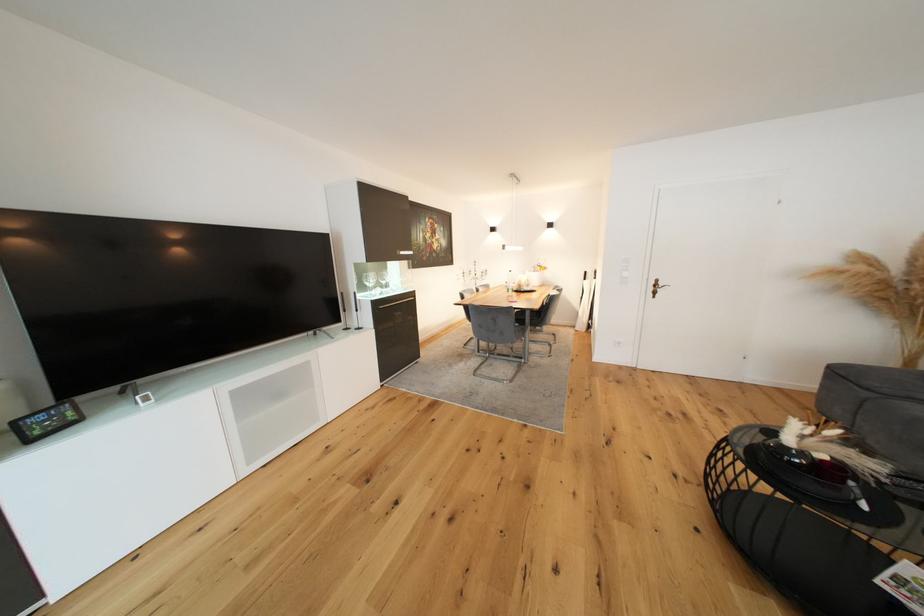
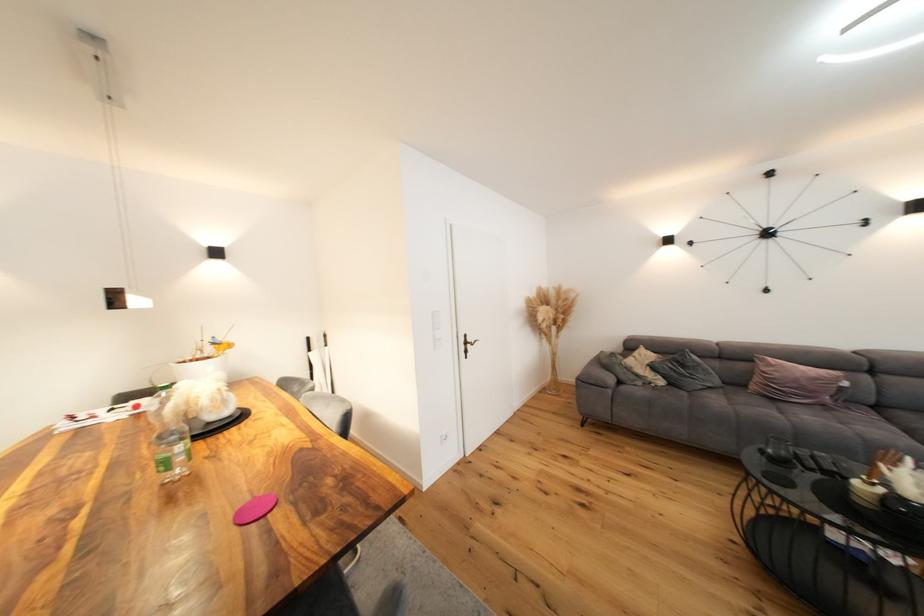
Find the pixel in the second image that matches the point at 667,286 in the first image.

(476, 341)